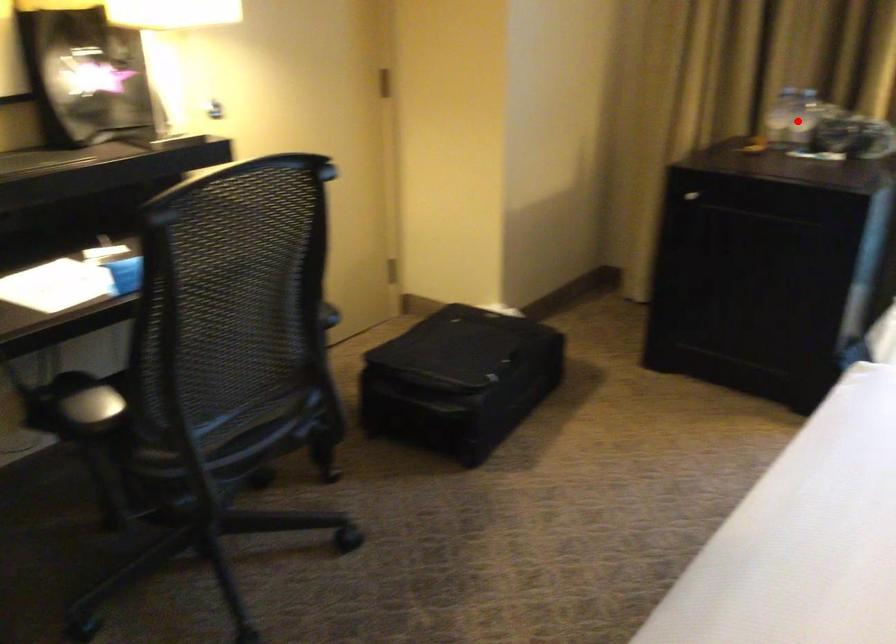
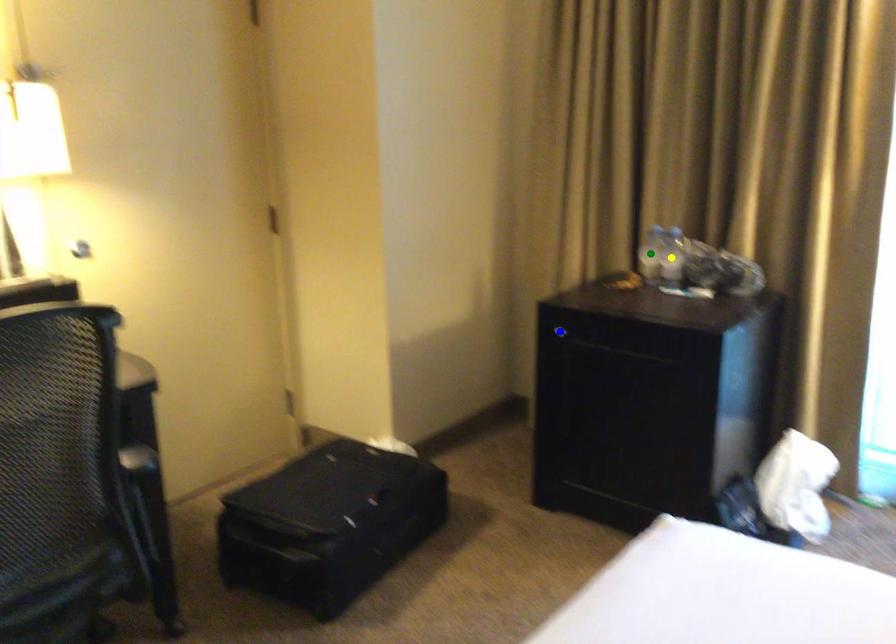
Question: I am providing you with two images of the same scene from different viewpoints. A red point is marked on the first image. You are given multiple points on the second image. Which spot in image 2 lines up with the point in image 1?

Choices:
 (A) blue point
 (B) green point
 (C) yellow point

Answer: (C)